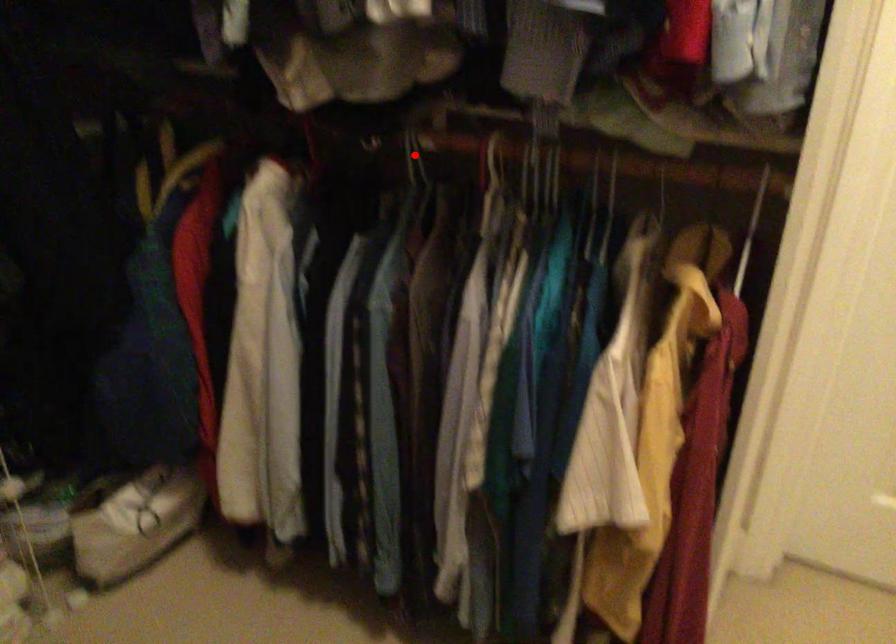
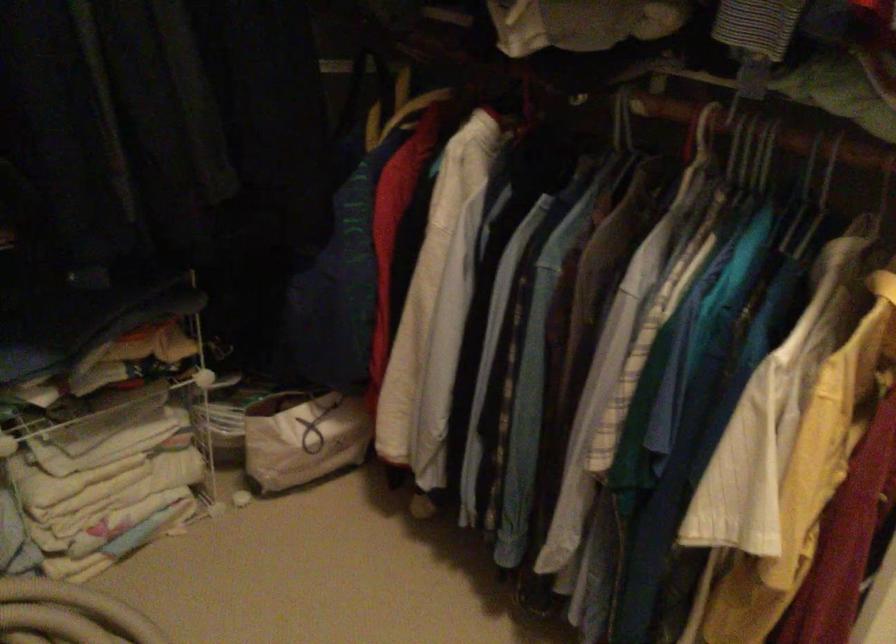
Where in the second image is the point corresponding to the highlighted location from the first image?

(622, 122)